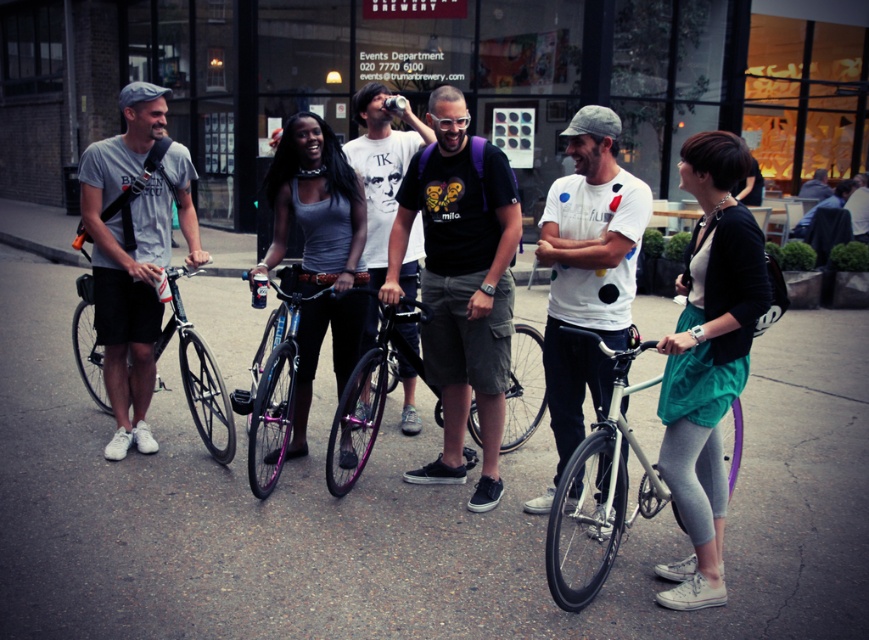
Who is more distant from viewer, (x=463, y=259) or (x=340, y=460)?

Point (x=340, y=460)

Between black matte t-shirt at center and purple metallic bicycle at center, which one appears on the right side from the viewer's perspective?

black matte t-shirt at center is more to the right.

Is point (469, 259) in front of point (377, 378)?

Yes, point (469, 259) is closer to viewer.

The image size is (869, 640). Identify the location of black matte t-shirt at center. (461, 284).

Is gray asphalt pavement at center positioned before shiny purple bicycle at center?

Yes, it is in front of shiny purple bicycle at center.

Is point (850, 618) less distant than point (250, 467)?

Yes, point (850, 618) is closer to viewer.

Is point (615, 605) closer to viewer compared to point (277, 442)?

That is True.

Find the location of `gray asphalt pavement at center`. gray asphalt pavement at center is located at coordinates (399, 512).

Does point (442, 256) come farther from viewer compared to point (406, 428)?

That is False.

Which is more to the left, black matte t-shirt at center or matte white t-shirt at center?

matte white t-shirt at center

Is point (488, 445) more distant than point (416, 237)?

No.

Where is `black matte t-shirt at center`? black matte t-shirt at center is located at coordinates (461, 284).